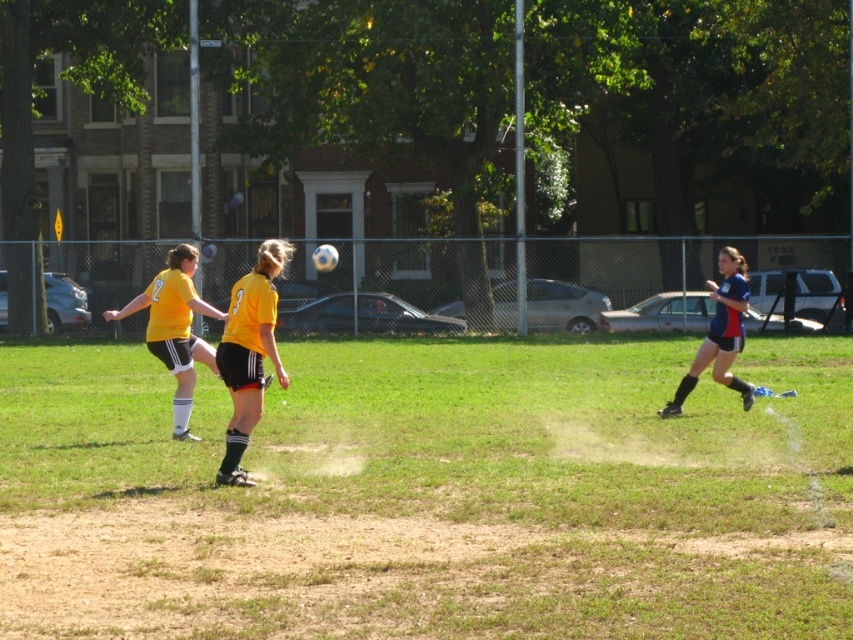
Is point (247, 314) less distant than point (177, 296)?

That is True.

Who is more forward, (242,301) or (194,356)?

Positioned in front is point (242,301).

Where is `yellow matte jersey at center`? This screenshot has width=853, height=640. yellow matte jersey at center is located at coordinates (248, 353).

Where is `green grass at center`? The width and height of the screenshot is (853, 640). green grass at center is located at coordinates (431, 496).

Who is positioned more to the left, green grass at center or yellow matte jersey at left?

yellow matte jersey at left

Does point (161, 552) lie in front of point (172, 372)?

Yes, point (161, 552) is in front of point (172, 372).

In order to click on green grass at center in this screenshot , I will do [431, 496].

Who is taller, green grass at center or blue fabric uniform at right?

Standing taller between the two is blue fabric uniform at right.

The image size is (853, 640). What do you see at coordinates (431, 496) in the screenshot?
I see `green grass at center` at bounding box center [431, 496].

The width and height of the screenshot is (853, 640). I want to click on green grass at center, so click(x=431, y=496).

The image size is (853, 640). What are the coordinates of `green grass at center` in the screenshot? It's located at click(x=431, y=496).